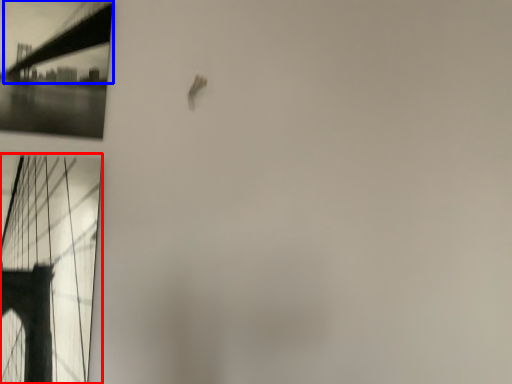
Question: Among these objects, which one is farthest to the camera, window (highlighted by a red box) or suspension bridge (highlighted by a blue box)?

Choices:
 (A) window
 (B) suspension bridge

Answer: (B)